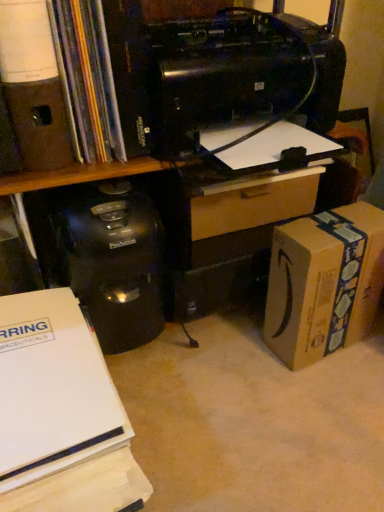
Question: Is brown cardboard box at lower right to the right of wooden drawer at center from the viewer's perspective?

Choices:
 (A) no
 (B) yes

Answer: (B)

Question: Is brown cardboard box at lower right smaller than wooden drawer at center?

Choices:
 (A) no
 (B) yes

Answer: (A)

Question: Is brown cardboard box at lower right not within wooden drawer at center?

Choices:
 (A) no
 (B) yes

Answer: (B)

Question: Can you confirm if brown cardboard box at lower right is wider than wooden drawer at center?

Choices:
 (A) yes
 (B) no

Answer: (A)

Question: Does brown cardboard box at lower right turn towards wooden drawer at center?

Choices:
 (A) yes
 (B) no

Answer: (B)

Question: Can you confirm if brown cardboard box at lower right is positioned to the left of wooden drawer at center?

Choices:
 (A) no
 (B) yes

Answer: (A)

Question: From a real-world perspective, is white paper at lower left, positioned as the 1th office supplies in bottom-to-top order, under matte black book at upper left?

Choices:
 (A) yes
 (B) no

Answer: (A)

Question: Is white paper at lower left, placed as the 2th office supplies when sorted from top to bottom, far from matte black book at upper left?

Choices:
 (A) yes
 (B) no

Answer: (B)

Question: From the image's perspective, is white paper at lower left, positioned as the 1th office supplies in bottom-to-top order, below matte black book at upper left?

Choices:
 (A) no
 (B) yes

Answer: (B)

Question: Does white paper at lower left, placed as the 2th office supplies when sorted from top to bottom, appear on the left side of matte black book at upper left?

Choices:
 (A) no
 (B) yes

Answer: (B)

Question: Is white paper at lower left, positioned as the 1th office supplies in bottom-to-top order, positioned with its back to matte black book at upper left?

Choices:
 (A) no
 (B) yes

Answer: (A)

Question: Is white paper at lower left, placed as the 2th office supplies when sorted from top to bottom, next to matte black book at upper left?

Choices:
 (A) no
 (B) yes

Answer: (A)

Question: Is matte black book at upper left oriented away from white paper at lower left, positioned as the 1th office supplies in bottom-to-top order?

Choices:
 (A) no
 (B) yes

Answer: (A)